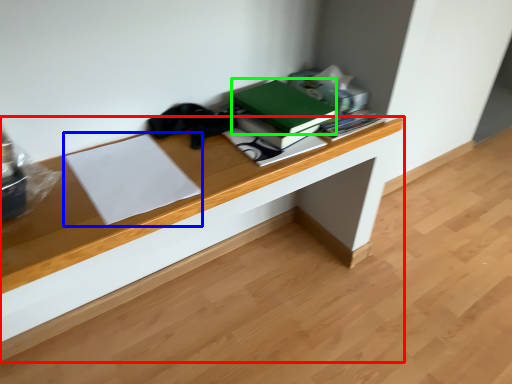
Question: Considering the real-world distances, which object is closest to desk (highlighted by a red box)? paperback book (highlighted by a blue box) or paperback book (highlighted by a green box).

Choices:
 (A) paperback book
 (B) paperback book

Answer: (A)